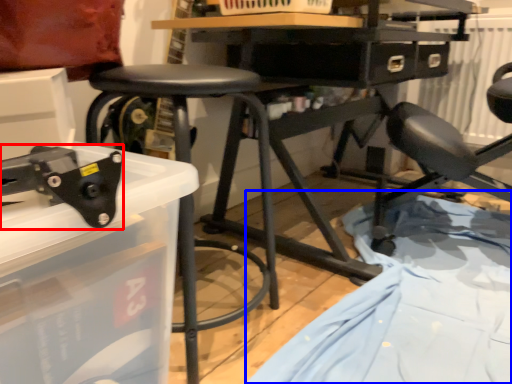
Question: Among these objects, which one is nearest to the camera, tool (highlighted by a red box) or sheet (highlighted by a blue box)?

Choices:
 (A) tool
 (B) sheet

Answer: (A)